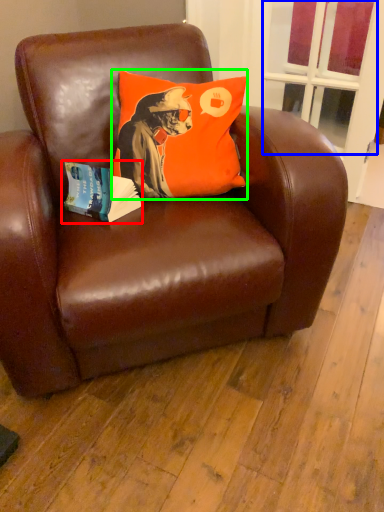
Question: Which is nearer to the paperback book (highlighted by a red box)? window screen (highlighted by a blue box) or pillow (highlighted by a green box).

Choices:
 (A) window screen
 (B) pillow

Answer: (B)